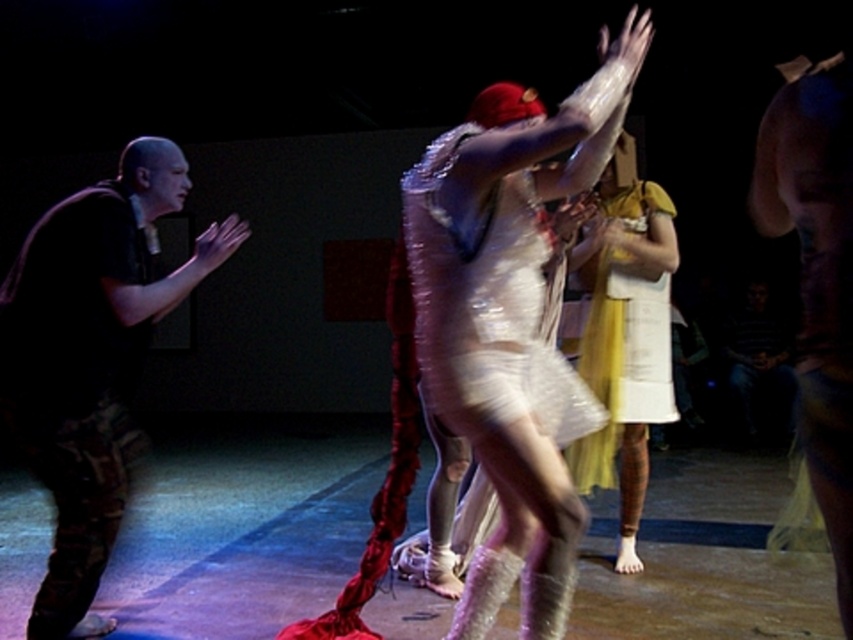
Question: Which of the following is the farthest from the observer?

Choices:
 (A) (457, 195)
 (B) (607, 260)

Answer: (B)

Question: Is shiny silver dress at center to the left of shiny white dress at center from the viewer's perspective?

Choices:
 (A) no
 (B) yes

Answer: (A)

Question: Which of these objects is positioned closest to the shiny white dress at center?

Choices:
 (A) shiny silver dress at center
 (B) yellow satin dress at center
 (C) camouflage pants at left
 (D) camouflage pants at right

Answer: (A)

Question: Based on their relative distances, which object is farther from the shiny silver dress at center?

Choices:
 (A) shiny white dress at center
 (B) camouflage pants at right

Answer: (B)

Question: Does shiny silver dress at center appear on the left side of camouflage pants at right?

Choices:
 (A) yes
 (B) no

Answer: (A)

Question: Can you confirm if camouflage pants at left is positioned to the left of shiny white dress at center?

Choices:
 (A) yes
 (B) no

Answer: (A)